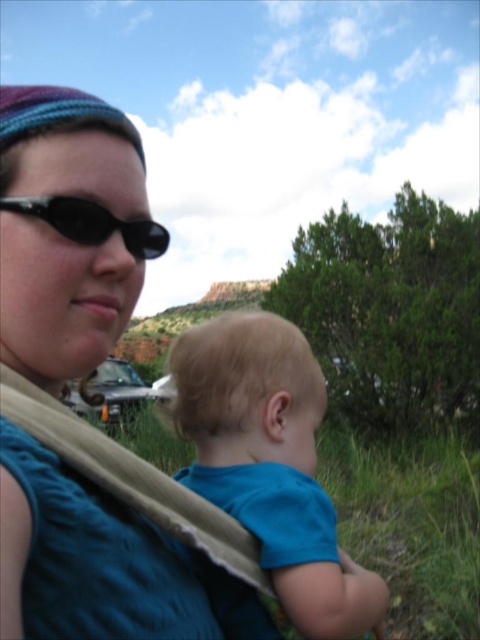
You are a photographer trying to capture a photo of the blue knitted hat at upper left and the blue soft fabric toddler at center. Which object should you focus on first if you want to ensure both are in sharp focus, considering their sizes?

The blue knitted hat at upper left is much taller than the blue soft fabric toddler at center, so focusing on the taller object first would help ensure both are in sharp focus.

You are a photographer trying to capture a closeup shot of the baby in the carrier. You notice two items in the upper left corner of your viewfinder. Which item would you need to adjust your focus to include both the blue knitted hat at upper left and the black matte sunglasses at upper left in the frame?

The blue knitted hat at upper left is larger in size than the black matte sunglasses at upper left. To include both in the frame, adjust focus to account for the larger size of the blue knitted hat at upper left.

You are a photographer trying to capture a clear shot of both the blue knitted hat at upper left and the blue soft fabric toddler at center. Based on their positions, which object should you focus on first to ensure both are in focus?

The blue knitted hat at upper left is closer to the viewer than the blue soft fabric toddler at center. To ensure both are in focus, focus on the blue knitted hat at upper left first since it is closer, and the toddler will be in the background.